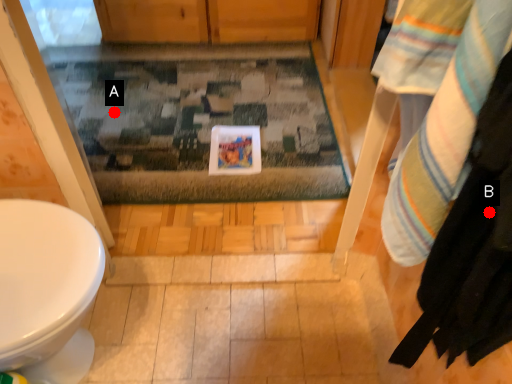
Question: Two points are circled on the image, labeled by A and B beside each circle. Which point is closer to the camera taking this photo?

Choices:
 (A) A is closer
 (B) B is closer

Answer: (B)